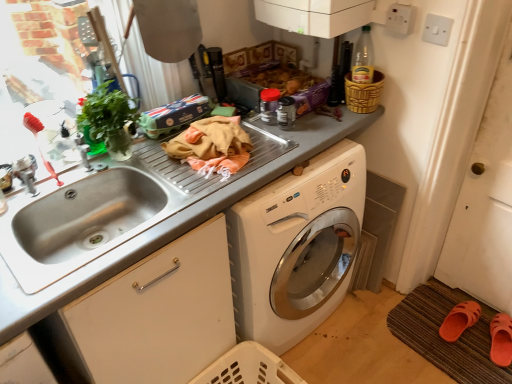
Locate an element on the screen. This screenshot has width=512, height=384. free point in front of orange rubber slipper at lower right is located at coordinates (466, 360).